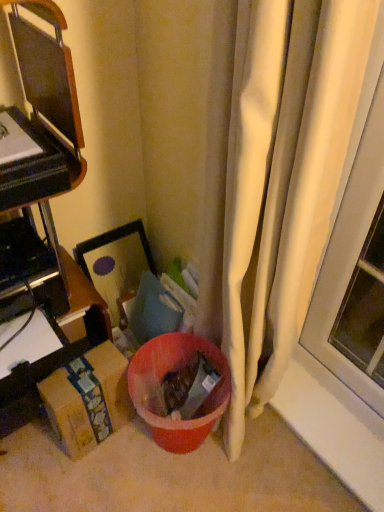
What is the approximate width of brown cardboard box at left, which ranks as the 2th furniture in top-to-bottom order?

It is 14.67 inches.

What is the approximate width of brown cardboard box at left, the second furniture ordered from the bottom?

brown cardboard box at left, the second furniture ordered from the bottom, is 14.31 inches wide.

Measure the distance between point (3, 253) and camera.

1.08 meters.

This screenshot has width=384, height=512. What do you see at coordinates (88, 399) in the screenshot?
I see `brown cardboard box at lower left` at bounding box center [88, 399].

Find the location of a particular element. This screenshot has width=384, height=512. brown cardboard box at left, which is the first furniture in bottom-to-top order is located at coordinates (57, 350).

Is white fabric curtain at right smaller than brown cardboard box at lower left?

Incorrect, white fabric curtain at right is not smaller in size than brown cardboard box at lower left.

Which is behind, white fabric curtain at right or brown cardboard box at lower left?

brown cardboard box at lower left is further away from the camera.

Between white fabric curtain at right and brown cardboard box at lower left, which one has larger width?

white fabric curtain at right.

Looking at this image, which object is closer to the camera taking this photo, brown cardboard box at lower left or brown cardboard box at left, the second furniture ordered from the bottom?

Positioned in front is brown cardboard box at left, the second furniture ordered from the bottom.

Would you say brown cardboard box at lower left is a long distance from brown cardboard box at left, the 1th furniture viewed from the top?

No, brown cardboard box at lower left is not far away from brown cardboard box at left, the 1th furniture viewed from the top.

Which point is more forward, (77, 440) or (31, 251)?

The point (31, 251) is more forward.

Is brown cardboard box at lower left at the left side of brown cardboard box at left, the 1th furniture viewed from the top?

No, brown cardboard box at lower left is not to the left of brown cardboard box at left, the 1th furniture viewed from the top.

Is brown cardboard box at left, the 1th furniture viewed from the top, located outside brown cardboard box at lower left?

Yes, brown cardboard box at left, the 1th furniture viewed from the top, is outside of brown cardboard box at lower left.

Could you tell me if brown cardboard box at left, the 1th furniture viewed from the top, is facing brown cardboard box at lower left?

Yes, brown cardboard box at left, the 1th furniture viewed from the top, is facing brown cardboard box at lower left.

Considering the relative positions of brown cardboard box at left, the second furniture ordered from the bottom, and brown cardboard box at lower left in the image provided, is brown cardboard box at left, the second furniture ordered from the bottom, to the left of brown cardboard box at lower left from the viewer's perspective?

Indeed, brown cardboard box at left, the second furniture ordered from the bottom, is positioned on the left side of brown cardboard box at lower left.

Between point (73, 95) and point (94, 379), which one is positioned in front?

The point (73, 95) is more forward.

Is brown cardboard box at left, the second furniture ordered from the bottom, at the back of brown cardboard box at left, which ranks as the 2th furniture in top-to-bottom order?

Absolutely, brown cardboard box at left, which ranks as the 2th furniture in top-to-bottom order, is directed away from brown cardboard box at left, the second furniture ordered from the bottom.

Is brown cardboard box at left, which ranks as the 2th furniture in top-to-bottom order, closer to the viewer compared to brown cardboard box at left, the 1th furniture viewed from the top?

No, it is behind brown cardboard box at left, the 1th furniture viewed from the top.

Is brown cardboard box at left, which ranks as the 2th furniture in top-to-bottom order, taller than brown cardboard box at left, the second furniture ordered from the bottom?

In fact, brown cardboard box at left, which ranks as the 2th furniture in top-to-bottom order, may be shorter than brown cardboard box at left, the second furniture ordered from the bottom.

Find the location of a particular element. furniture positioned vertically above the brown cardboard box at left, which ranks as the 2th furniture in top-to-bottom order (from a real-world perspective) is located at coordinates (38, 164).

Does white fabric curtain at right have a greater height compared to brown cardboard box at left, the 1th furniture viewed from the top?

Correct, white fabric curtain at right is much taller as brown cardboard box at left, the 1th furniture viewed from the top.

Consider the image. Do you think white fabric curtain at right is within brown cardboard box at left, the second furniture ordered from the bottom, or outside of it?

white fabric curtain at right is outside brown cardboard box at left, the second furniture ordered from the bottom.

Is white fabric curtain at right at the right side of brown cardboard box at left, the second furniture ordered from the bottom?

Result: Yes.

Is white fabric curtain at right positioned in front of brown cardboard box at left, the second furniture ordered from the bottom?

Yes, white fabric curtain at right is in front of brown cardboard box at left, the second furniture ordered from the bottom.

Can you tell me how much brown cardboard box at left, which is the first furniture in bottom-to-top order, and white fabric curtain at right differ in facing direction?

There is a 91.2-degree angle between the facing directions of brown cardboard box at left, which is the first furniture in bottom-to-top order, and white fabric curtain at right.

Is brown cardboard box at left, which is the first furniture in bottom-to-top order, outside of white fabric curtain at right?

brown cardboard box at left, which is the first furniture in bottom-to-top order, is positioned outside white fabric curtain at right.

In the image, is brown cardboard box at left, which ranks as the 2th furniture in top-to-bottom order, positioned in front of or behind white fabric curtain at right?

Clearly, brown cardboard box at left, which ranks as the 2th furniture in top-to-bottom order, is behind white fabric curtain at right.

From the image's perspective, which is above, brown cardboard box at left, which ranks as the 2th furniture in top-to-bottom order, or white fabric curtain at right?

From the image's view, white fabric curtain at right is above.

Consider the image. Is brown cardboard box at left, the second furniture ordered from the bottom, inside the boundaries of brown cardboard box at left, which ranks as the 2th furniture in top-to-bottom order, or outside?

brown cardboard box at left, the second furniture ordered from the bottom, is spatially situated outside brown cardboard box at left, which ranks as the 2th furniture in top-to-bottom order.

Is brown cardboard box at left, the second furniture ordered from the bottom, looking in the opposite direction of brown cardboard box at left, which ranks as the 2th furniture in top-to-bottom order?

brown cardboard box at left, the second furniture ordered from the bottom, is not turned away from brown cardboard box at left, which ranks as the 2th furniture in top-to-bottom order.

Between brown cardboard box at left, the 1th furniture viewed from the top, and brown cardboard box at left, which is the first furniture in bottom-to-top order, which one is positioned in front?

brown cardboard box at left, the 1th furniture viewed from the top, is closer to the camera.

Is brown cardboard box at left, the 1th furniture viewed from the top, bigger than brown cardboard box at left, which ranks as the 2th furniture in top-to-bottom order?

Yes, brown cardboard box at left, the 1th furniture viewed from the top, is bigger than brown cardboard box at left, which ranks as the 2th furniture in top-to-bottom order.

At what (x,y) coordinates should I click in order to perform the action: click on curtain that is in front of the brown cardboard box at lower left. Please return your answer as a coordinate pair (x, y). The image size is (384, 512). Looking at the image, I should click on (273, 176).

Where is `furniture above the brown cardboard box at lower left (from a real-world perspective)`? furniture above the brown cardboard box at lower left (from a real-world perspective) is located at coordinates (38, 164).

Considering their positions, is brown cardboard box at left, the 1th furniture viewed from the top, positioned closer to brown cardboard box at left, which is the first furniture in bottom-to-top order, than brown cardboard box at lower left?

brown cardboard box at lower left.

When comparing their distances from brown cardboard box at lower left, does brown cardboard box at left, which ranks as the 2th furniture in top-to-bottom order, or white fabric curtain at right seem closer?

brown cardboard box at left, which ranks as the 2th furniture in top-to-bottom order, is closer to brown cardboard box at lower left.

Which object lies further to the anchor point brown cardboard box at left, the 1th furniture viewed from the top, white fabric curtain at right or brown cardboard box at lower left?

white fabric curtain at right lies further to brown cardboard box at left, the 1th furniture viewed from the top, than the other object.

Estimate the real-world distances between objects in this image. Which object is further from brown cardboard box at lower left, brown cardboard box at left, which ranks as the 2th furniture in top-to-bottom order, or brown cardboard box at left, the 1th furniture viewed from the top?

brown cardboard box at left, the 1th furniture viewed from the top, is further to brown cardboard box at lower left.

Estimate the real-world distances between objects in this image. Which object is further from brown cardboard box at lower left, brown cardboard box at left, the second furniture ordered from the bottom, or brown cardboard box at left, which is the first furniture in bottom-to-top order?

brown cardboard box at left, the second furniture ordered from the bottom.

Considering their positions, is white fabric curtain at right positioned further to brown cardboard box at lower left than brown cardboard box at left, which is the first furniture in bottom-to-top order?

The object further to brown cardboard box at lower left is white fabric curtain at right.

From the image, which object appears to be nearer to brown cardboard box at left, which ranks as the 2th furniture in top-to-bottom order, white fabric curtain at right or brown cardboard box at left, the 1th furniture viewed from the top?

Based on the image, brown cardboard box at left, the 1th furniture viewed from the top, appears to be nearer to brown cardboard box at left, which ranks as the 2th furniture in top-to-bottom order.

Estimate the real-world distances between objects in this image. Which object is closer to brown cardboard box at left, the 1th furniture viewed from the top, brown cardboard box at left, which ranks as the 2th furniture in top-to-bottom order, or brown cardboard box at lower left?

The object closer to brown cardboard box at left, the 1th furniture viewed from the top, is brown cardboard box at left, which ranks as the 2th furniture in top-to-bottom order.

The width and height of the screenshot is (384, 512). In order to click on furniture between white fabric curtain at right and brown cardboard box at left, which is the first furniture in bottom-to-top order, along the z-axis in this screenshot , I will do `click(38, 164)`.

Where is `cardboard box positioned between white fabric curtain at right and brown cardboard box at left, which ranks as the 2th furniture in top-to-bottom order, from near to far`? This screenshot has height=512, width=384. cardboard box positioned between white fabric curtain at right and brown cardboard box at left, which ranks as the 2th furniture in top-to-bottom order, from near to far is located at coordinates (88, 399).

The image size is (384, 512). Find the location of `cardboard box between brown cardboard box at left, the 1th furniture viewed from the top, and brown cardboard box at left, which ranks as the 2th furniture in top-to-bottom order, from front to back`. cardboard box between brown cardboard box at left, the 1th furniture viewed from the top, and brown cardboard box at left, which ranks as the 2th furniture in top-to-bottom order, from front to back is located at coordinates (88, 399).

Locate an element on the screen. furniture between white fabric curtain at right and brown cardboard box at lower left along the z-axis is located at coordinates (38, 164).